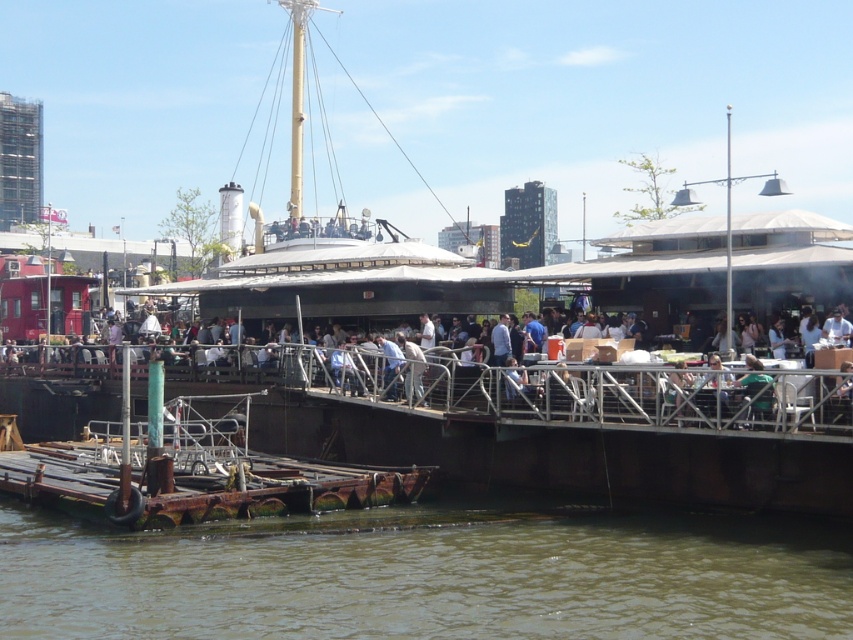
You are a visitor at the waterfront and want to sit down. You see a white plastic chair at center and brown murky water at lower center. Which object is positioned to the right of the other?

The brown murky water at lower center is positioned to the right of the white plastic chair at center.